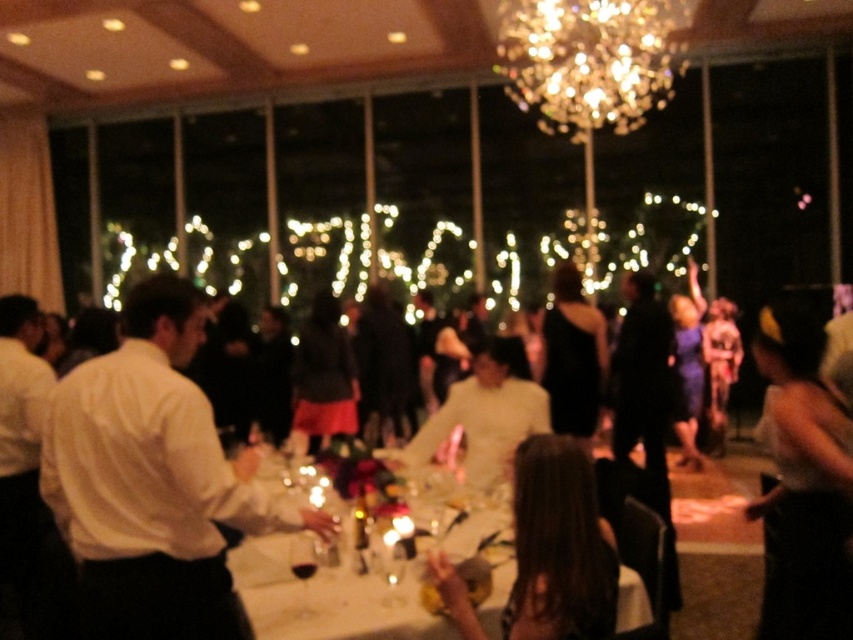
You are a photographer at the event and want to capture a clear shot of the transparent glass wine at lower center without the sparkling crystal chandelier at upper center blocking it. How should you adjust your camera position?

To avoid the sparkling crystal chandelier at upper center blocking the transparent glass wine at lower center, you should position your camera lower so that the wine glass is framed below the chandelier.

You are a photographer at the event and want to capture a photo of the white shirt at left and the sparkling crystal chandelier at upper center. Which object is narrower in your camera frame?

The white shirt at left is thinner than the sparkling crystal chandelier at upper center, so the white shirt at left is narrower in the camera frame.

You are standing at the point with coordinates point (578, 492) and want to move to the exit located at point (822, 445). Can you walk directly to the exit without moving around any obstacles?

Point (822, 445) is behind point (578, 492), so you cannot walk directly to the exit without moving around point (578, 492).